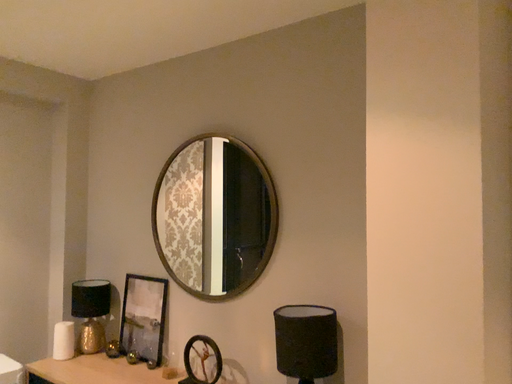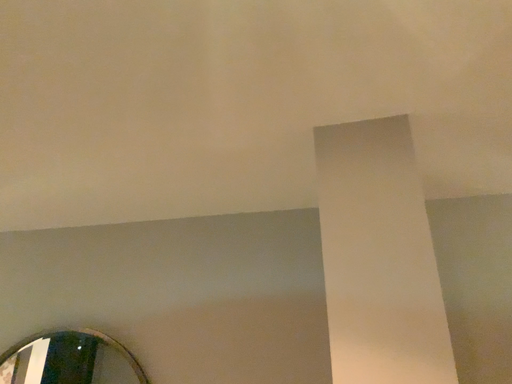
Question: How did the camera likely rotate when shooting the video?

Choices:
 (A) rotated upward
 (B) rotated downward

Answer: (A)